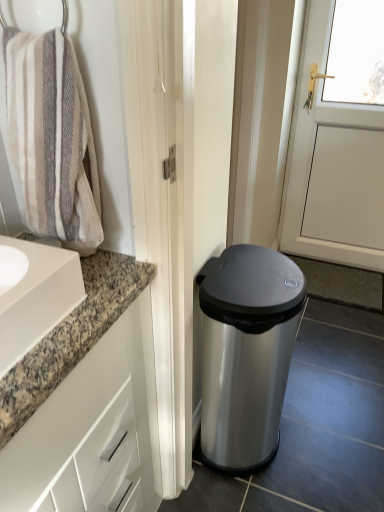
Locate an element on the screen. free point to the right of satin silver trash can at lower right is located at coordinates (322, 444).